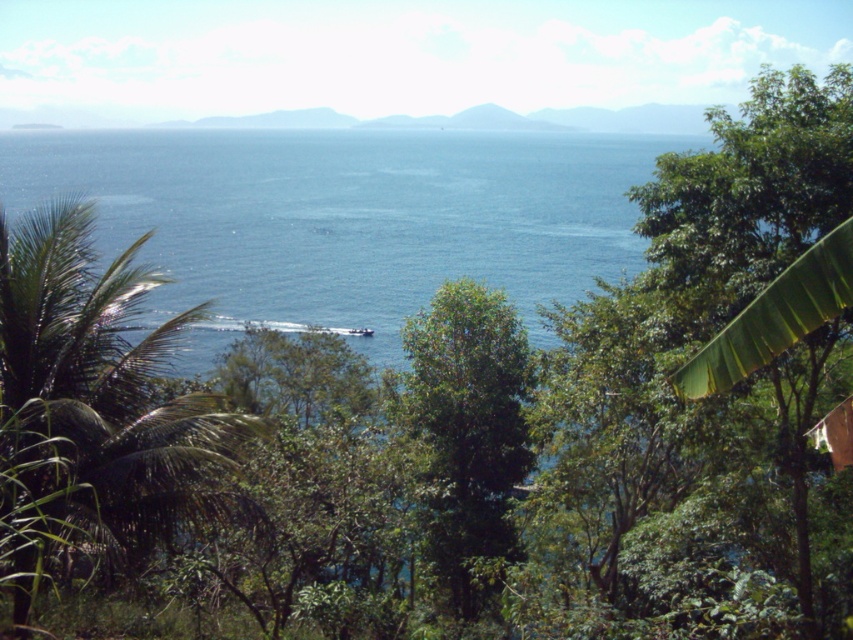
You are standing at the point marked by the coordinates point (91, 406) in the coastal scene. Looking towards the ocean, which direction should you face to see the green leafy palm tree at center left?

The point (91, 406) corresponds to the green leafy palm tree at center left. To see the palm tree, you should face towards the center left from your current position.